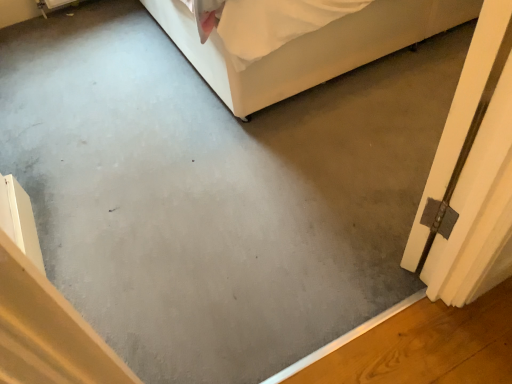
Question: From the image's perspective, is white fabric bed at upper center positioned above or below metallic silver hinge at right?

Choices:
 (A) above
 (B) below

Answer: (A)

Question: Is point (228, 59) closer or farther from the camera than point (488, 261)?

Choices:
 (A) farther
 (B) closer

Answer: (A)

Question: Would you say white fabric bed at upper center is inside or outside metallic silver hinge at right?

Choices:
 (A) inside
 (B) outside

Answer: (B)

Question: In terms of width, does metallic silver hinge at right look wider or thinner when compared to white fabric bed at upper center?

Choices:
 (A) wide
 (B) thin

Answer: (B)

Question: From the image's perspective, is metallic silver hinge at right above or below white fabric bed at upper center?

Choices:
 (A) above
 (B) below

Answer: (B)

Question: Choose the correct answer: Is metallic silver hinge at right inside white fabric bed at upper center or outside it?

Choices:
 (A) inside
 (B) outside

Answer: (B)

Question: Considering the positions of metallic silver hinge at right and white fabric bed at upper center in the image, is metallic silver hinge at right bigger or smaller than white fabric bed at upper center?

Choices:
 (A) small
 (B) big

Answer: (A)